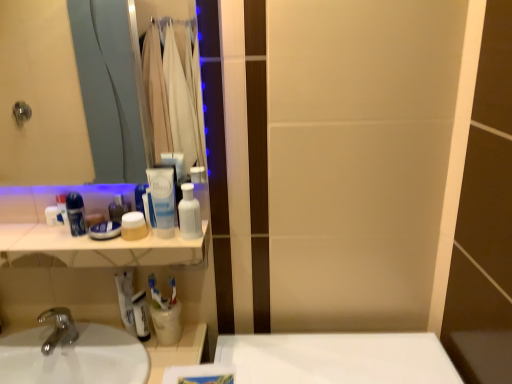
In order to click on free space above white glossy sink at lower left (from a real-world perspective) in this screenshot , I will do `click(65, 337)`.